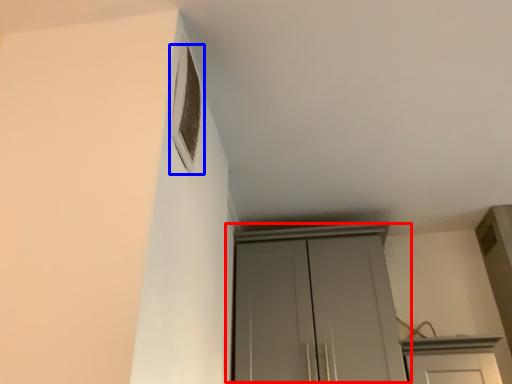
Question: Which point is closer to the camera, cupboard (highlighted by a red box) or window (highlighted by a blue box)?

Choices:
 (A) cupboard
 (B) window

Answer: (B)